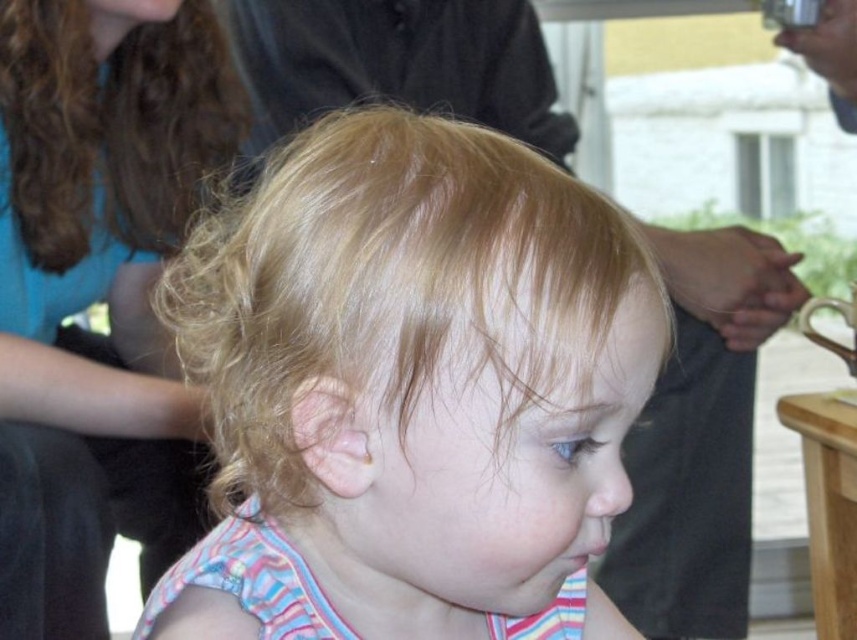
Is blonde hair at upper left to the left of curly brown hair at upper left from the viewer's perspective?

Correct, you'll find blonde hair at upper left to the left of curly brown hair at upper left.

Is blonde hair at upper left further to camera compared to curly brown hair at upper left?

No, blonde hair at upper left is closer to the viewer.

Is point (57, 387) farther from camera compared to point (178, 184)?

No, (57, 387) is in front of (178, 184).

Where is `blonde hair at upper left`? The height and width of the screenshot is (640, 857). blonde hair at upper left is located at coordinates (99, 291).

The image size is (857, 640). I want to click on blonde hair at center, so click(409, 390).

In the scene shown: Is blonde hair at center shorter than curly brown hair at upper left?

Yes.

At what (x,y) coordinates should I click in order to perform the action: click on blonde hair at center. Please return your answer as a coordinate pair (x, y). The image size is (857, 640). Looking at the image, I should click on (409, 390).

Locate an element on the screen. The image size is (857, 640). blonde hair at center is located at coordinates (409, 390).

Is point (602, 209) more distant than point (105, 349)?

No, it is not.

Does blonde hair at center have a lesser width compared to blonde hair at upper left?

No, blonde hair at center is not thinner than blonde hair at upper left.

Is point (252, 504) more distant than point (103, 509)?

No, (252, 504) is closer to viewer.

Where is `blonde hair at center`? Image resolution: width=857 pixels, height=640 pixels. blonde hair at center is located at coordinates (409, 390).